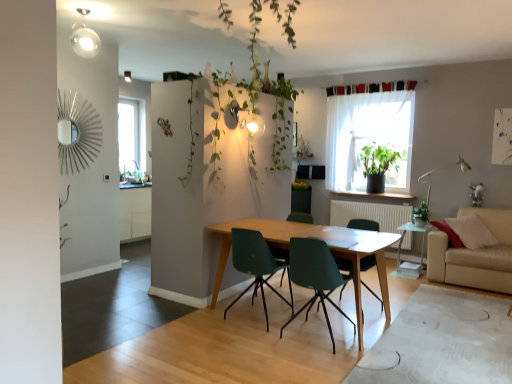
Question: Is matte green chair at center, the 2th chair from the left, smaller than teal plastic chair at center, which is the 2th chair from right to left?

Choices:
 (A) yes
 (B) no

Answer: (A)

Question: From a real-world perspective, is matte green chair at center, placed as the 3th chair when sorted from right to left, beneath teal plastic chair at center, acting as the third chair starting from the left?

Choices:
 (A) no
 (B) yes

Answer: (B)

Question: Considering the relative sizes of matte green chair at center, the 2th chair from the left, and teal plastic chair at center, which is the 2th chair from right to left, in the image provided, is matte green chair at center, the 2th chair from the left, taller than teal plastic chair at center, which is the 2th chair from right to left,?

Choices:
 (A) yes
 (B) no

Answer: (B)

Question: Can you confirm if matte green chair at center, placed as the 3th chair when sorted from right to left, is positioned to the right of teal plastic chair at center, which is the 2th chair from right to left?

Choices:
 (A) yes
 (B) no

Answer: (B)

Question: From a real-world perspective, is matte green chair at center, the 2th chair from the left, on teal plastic chair at center, which is the 2th chair from right to left?

Choices:
 (A) no
 (B) yes

Answer: (A)

Question: In terms of size, does matte green chair at center, the 2th chair from the left, appear bigger or smaller than green matte plant at window?

Choices:
 (A) big
 (B) small

Answer: (A)

Question: From a real-world perspective, is matte green chair at center, the 2th chair from the left, above or below green matte plant at window?

Choices:
 (A) below
 (B) above

Answer: (A)

Question: Considering the positions of matte green chair at center, the 2th chair from the left, and green matte plant at window in the image, is matte green chair at center, the 2th chair from the left, wider or thinner than green matte plant at window?

Choices:
 (A) thin
 (B) wide

Answer: (B)

Question: Which is correct: matte green chair at center, placed as the 3th chair when sorted from right to left, is inside green matte plant at window, or outside of it?

Choices:
 (A) outside
 (B) inside

Answer: (A)

Question: Do you think translucent fabric at upper right, the 1th window from the front, is within transparent glass window at upper left, placed as the second window when sorted from right to left, or outside of it?

Choices:
 (A) inside
 (B) outside

Answer: (B)

Question: From a real-world perspective, is translucent fabric at upper right, the 2th window viewed from the back, above or below transparent glass window at upper left, placed as the second window when sorted from right to left?

Choices:
 (A) above
 (B) below

Answer: (A)

Question: From the image's perspective, relative to transparent glass window at upper left, placed as the second window when sorted from right to left, is translucent fabric at upper right, the 2th window viewed from the back, above or below?

Choices:
 (A) below
 (B) above

Answer: (A)

Question: In terms of height, does translucent fabric at upper right, which is counted as the second window, starting from the left, look taller or shorter compared to transparent glass window at upper left, marked as the first window in a left-to-right arrangement?

Choices:
 (A) short
 (B) tall

Answer: (B)

Question: Which is correct: matte green plastic chair at center, placed as the first chair when sorted from left to right, is inside teal plastic chair at center, which is the 2th chair from right to left, or outside of it?

Choices:
 (A) inside
 (B) outside

Answer: (B)

Question: From the image's perspective, is matte green plastic chair at center, placed as the first chair when sorted from left to right, located above or below teal plastic chair at center, which is the 2th chair from right to left?

Choices:
 (A) below
 (B) above

Answer: (B)